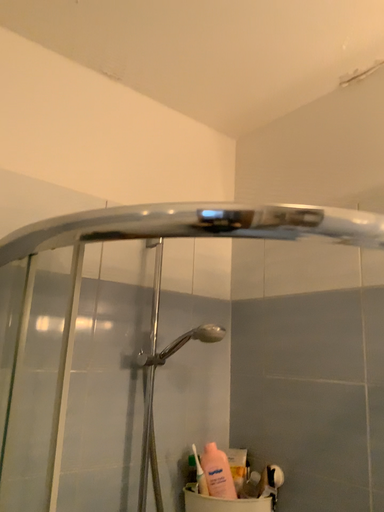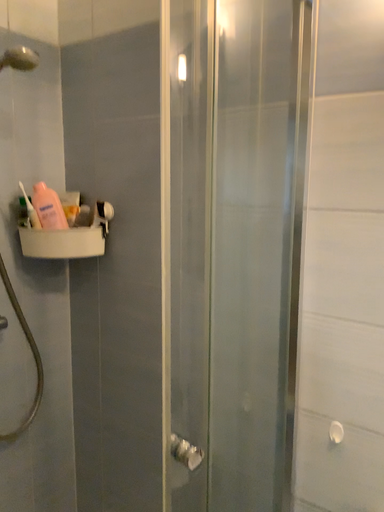
Question: How did the camera likely rotate when shooting the video?

Choices:
 (A) rotated left
 (B) rotated right

Answer: (B)